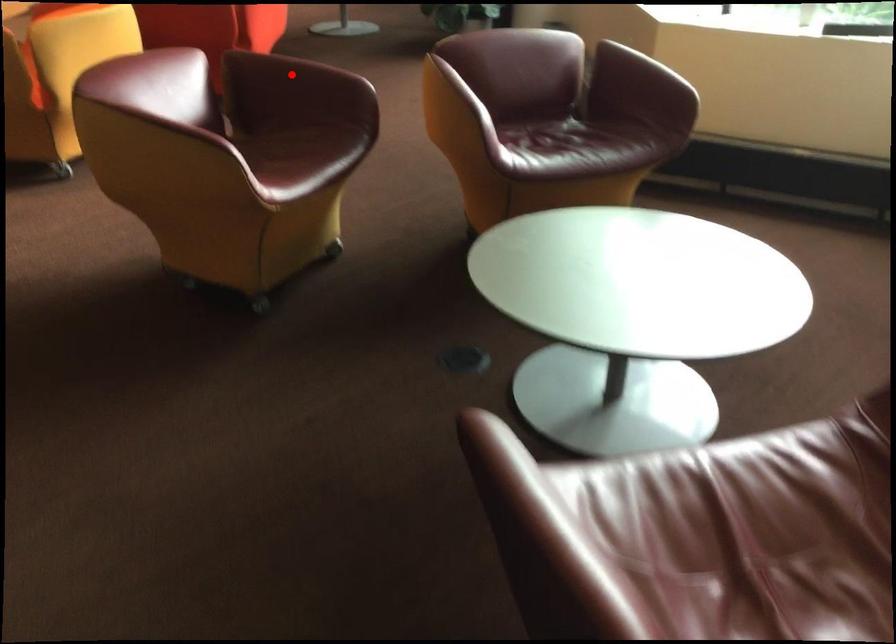
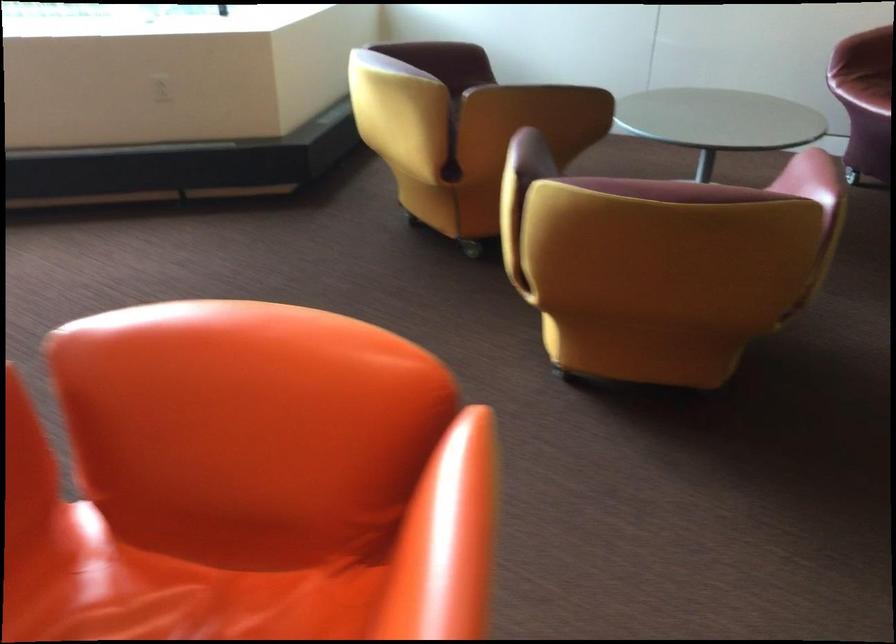
Question: I am providing you with two images of the same scene from different viewpoints. A red point is marked on the first image. Is the red point's position out of view in image 2?

Choices:
 (A) Yes
 (B) No

Answer: (A)